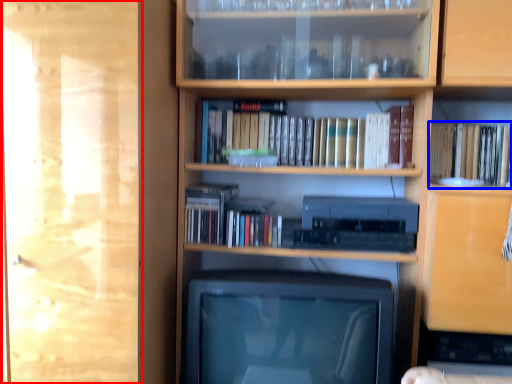
Question: Which object is closer to the camera taking this photo, glass door (highlighted by a red box) or book (highlighted by a blue box)?

Choices:
 (A) glass door
 (B) book

Answer: (A)